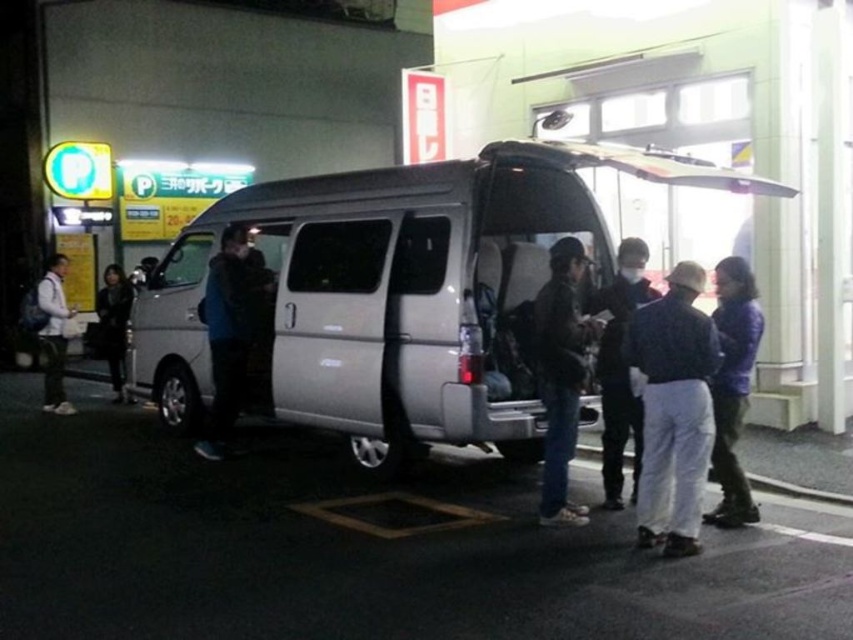
You are a photographer trying to capture a group photo of the people around the van. You notice the dark blue jacket at center and the white matte jacket at left. Which jacket should you focus on to ensure both jackets are equally visible in the photo?

The dark blue jacket at center has a smaller size compared to the white matte jacket at left. To ensure both are equally visible, focus on the white matte jacket at left since it is larger and will be more noticeable, allowing the smaller dark blue jacket at center to be seen alongside it.

You are a delivery person who needs to hand over a package to the person wearing the dark blue jacket at center. You are currently standing near the white cotton pants at lower right. Can you reach them without moving more than 30 inches?

The white cotton pants at lower right and dark blue jacket at center are 30.74 inches apart, so you cannot reach them without moving more than 30 inches since the distance is slightly over the limit.

Based on the photo, you are standing at the point marked as point (x=695, y=540) in this nighttime scene. You want to walk to the silver van parked on the street. Considering the distance between you and the van, can you estimate whether you are closer to the van than 20 feet?

The distance between you and the van is 16.66 feet, which is less than 20 feet. Therefore, you are closer to the van than 20 feet.